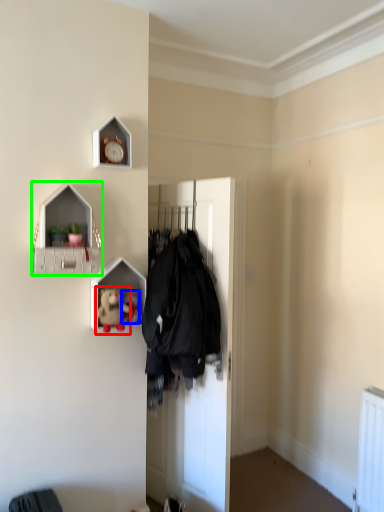
Question: Based on their relative distances, which object is farther from toy (highlighted by a red box)? Choose from toy (highlighted by a blue box) and shelf (highlighted by a green box).

Choices:
 (A) toy
 (B) shelf

Answer: (B)